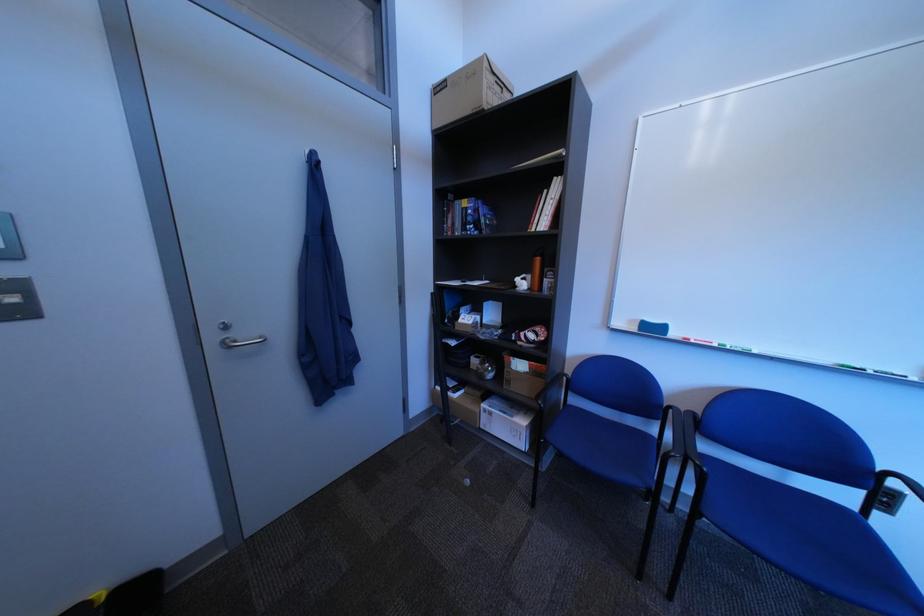
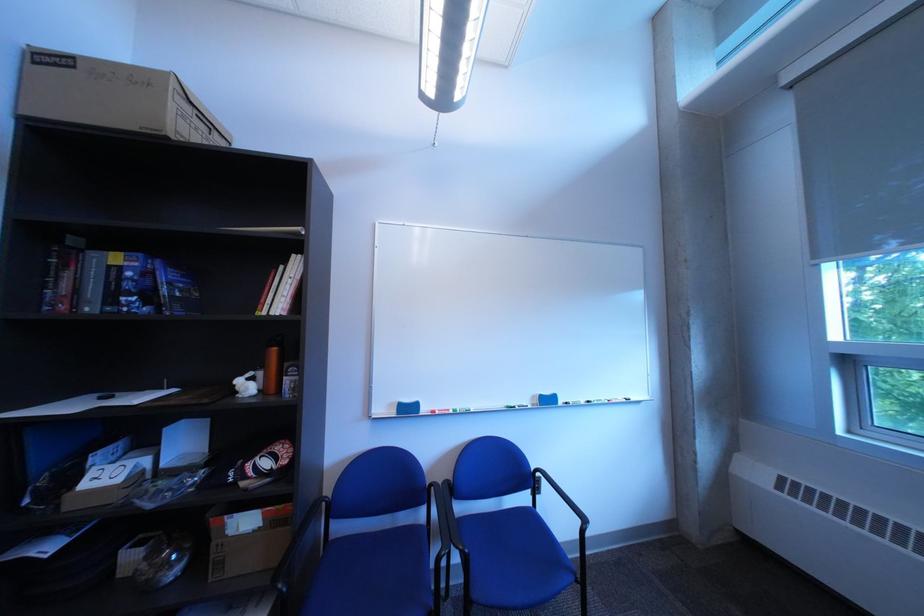
Question: The camera is either moving clockwise (left) or counter-clockwise (right) around the object. The first image is from the beginning of the video and the second image is from the end. Is the camera moving left or right when shooting the video?

Choices:
 (A) Left
 (B) Right

Answer: (A)